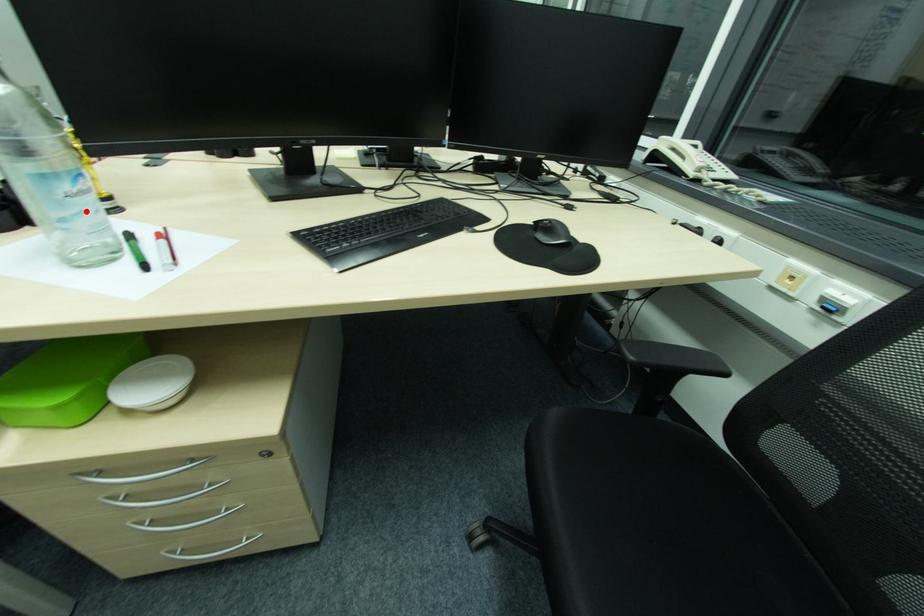
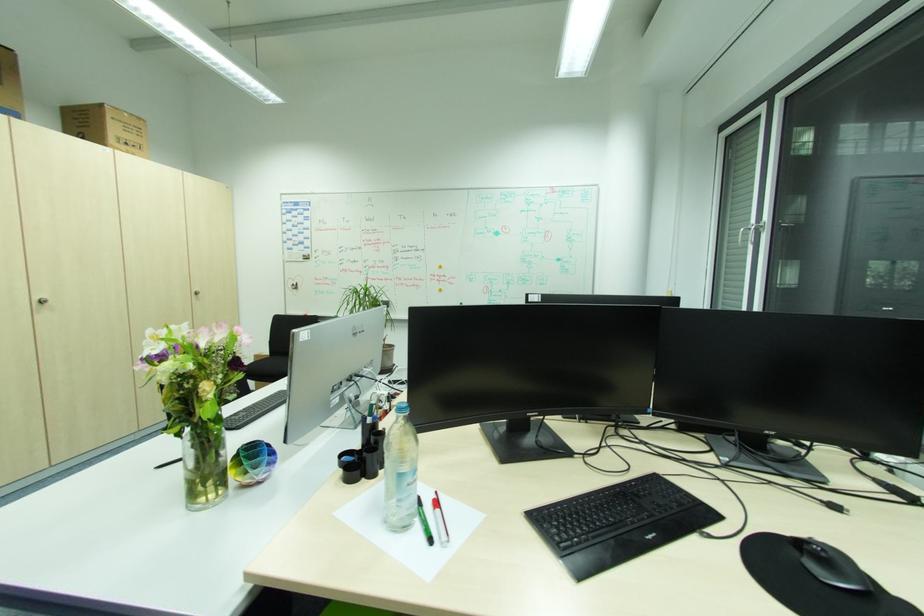
Find the pixel in the second image that matches the highlighted location in the first image.

(417, 495)